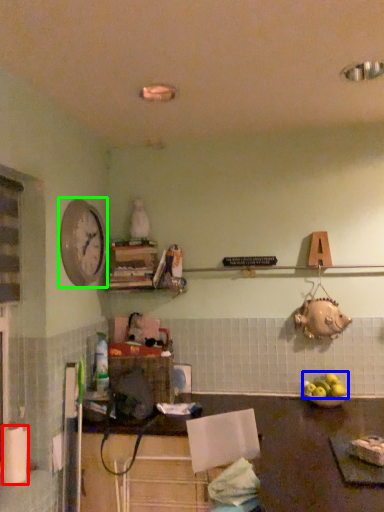
Question: Which is nearer to the paper towel (highlighted by a red box)? apple (highlighted by a blue box) or clock (highlighted by a green box).

Choices:
 (A) apple
 (B) clock

Answer: (B)